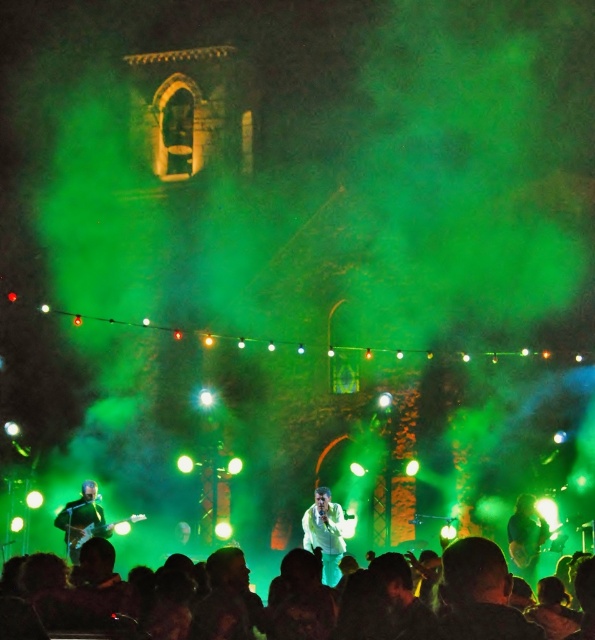
Question: Observing the image, what is the correct spatial positioning of silhouette crowd at lower center in reference to shiny black guitar at lower left?

Choices:
 (A) below
 (B) above

Answer: (A)

Question: Which object is positioned closest to the green fabric shirt at center?

Choices:
 (A) shiny black guitar at lower left
 (B) white glossy shirt at center

Answer: (B)

Question: Which object appears closest to the camera in this image?

Choices:
 (A) shiny black guitar at lower left
 (B) silhouette crowd at lower center

Answer: (B)

Question: Which object is farther from the camera taking this photo?

Choices:
 (A) green fabric shirt at center
 (B) silhouette crowd at lower center
 (C) white glossy shirt at center

Answer: (C)

Question: Observing the image, what is the correct spatial positioning of silhouette crowd at lower center in reference to white glossy shirt at center?

Choices:
 (A) right
 (B) left

Answer: (B)

Question: Does silhouette crowd at lower center have a lesser width compared to shiny black guitar at lower left?

Choices:
 (A) yes
 (B) no

Answer: (B)